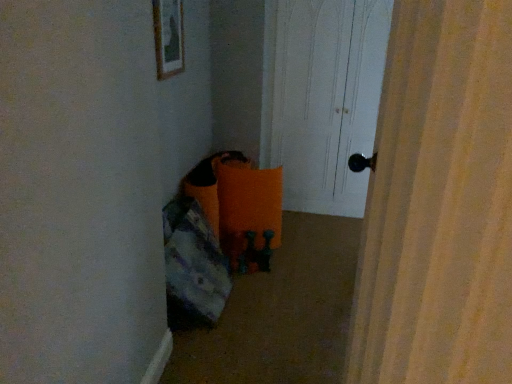
Question: Considering their positions, is white wood door at center located in front of or behind matte wooden picture frame at upper center?

Choices:
 (A) behind
 (B) front

Answer: (A)

Question: Looking at their shapes, would you say white wood door at center is wider or thinner than matte wooden picture frame at upper center?

Choices:
 (A) wide
 (B) thin

Answer: (A)

Question: Which object is the closest to the orange fabric bean bag at lower left?

Choices:
 (A) white wood door at center
 (B) matte wooden picture frame at upper center

Answer: (B)

Question: Which object is positioned farthest from the orange fabric bean bag at lower left?

Choices:
 (A) white wood door at center
 (B) matte wooden picture frame at upper center

Answer: (A)